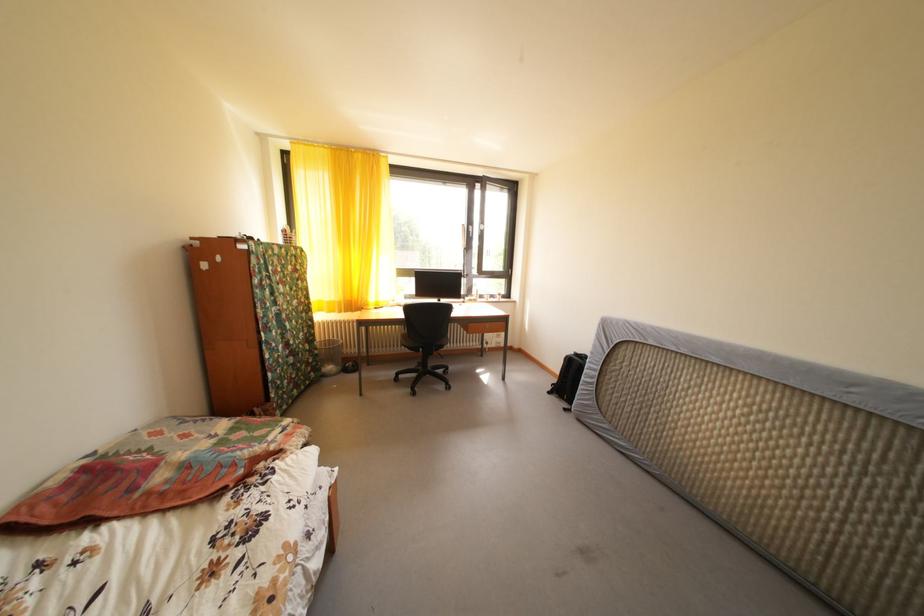
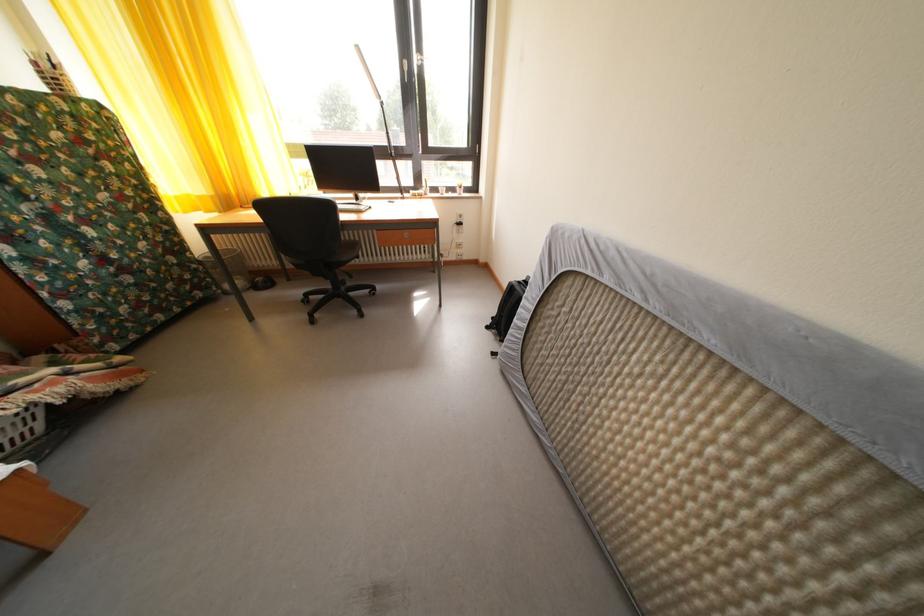
Where in the second image is the point corresponding to the point at 557,399 from the first image?

(496, 334)